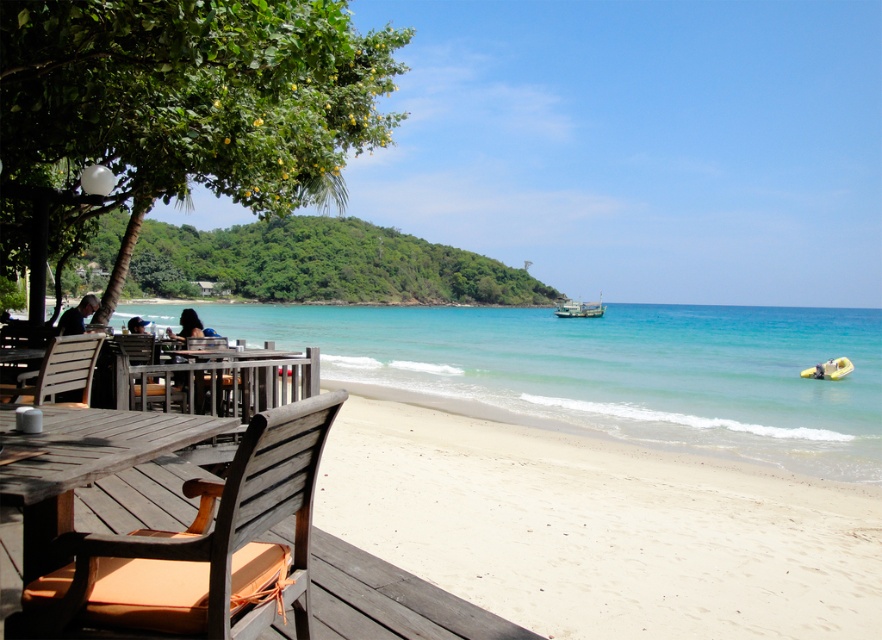
Question: Which object appears farthest from the camera in this image?

Choices:
 (A) wooden chair at left
 (B) wooden boat at center right
 (C) wooden chair at lower left

Answer: (B)

Question: Which of the following is the farthest from the observer?

Choices:
 (A) (36, 401)
 (B) (322, 426)
 (C) (812, 372)

Answer: (C)

Question: Is wooden chair at lower left below wooden boat at center right?

Choices:
 (A) yes
 (B) no

Answer: (A)

Question: Can you confirm if clear blue water at center is thinner than wooden table at lower left?

Choices:
 (A) yes
 (B) no

Answer: (B)

Question: Does white sandy beach at lower center appear over yellow rubber boat at lower right?

Choices:
 (A) no
 (B) yes

Answer: (B)

Question: Which of the following is the closest to the observer?

Choices:
 (A) (123, 563)
 (B) (688, 483)
 (C) (92, 339)

Answer: (A)